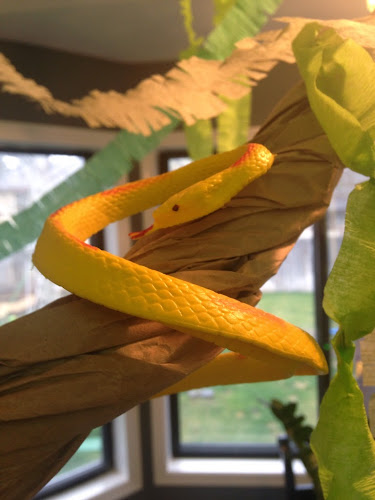
Where is `window sill`? This screenshot has height=500, width=375. window sill is located at coordinates (106, 447), (195, 455).